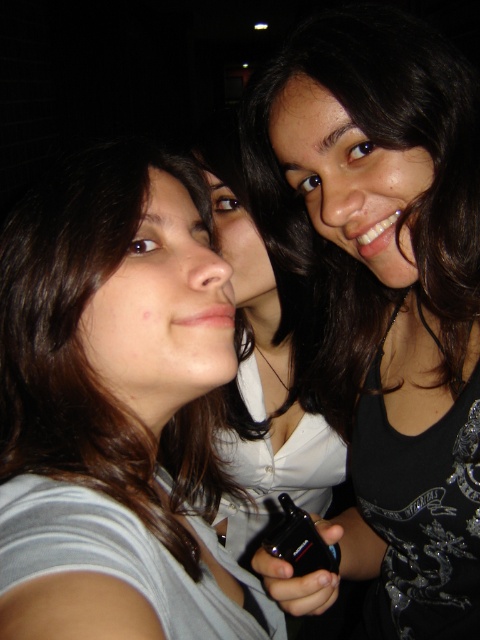
In the scene shown: Based on the scene description and the coordinates provided, what object is located at the point (389, 294) in the image?

The point (389, 294) corresponds to the black glossy phone at center.

You are trying to take a photo of the gray striped shirt at left and the black glossy phone at center. Which object will appear smaller in the photo?

The gray striped shirt at left will appear smaller in the photo because it is smaller than the black glossy phone at center.

You are standing in front of the three people in the image and want to throw a small ball to the area closer to you between the two points, point (195,518) and point (441,483). Which point should you aim for?

You should aim for point (195,518) because it is closer to you than point (441,483).